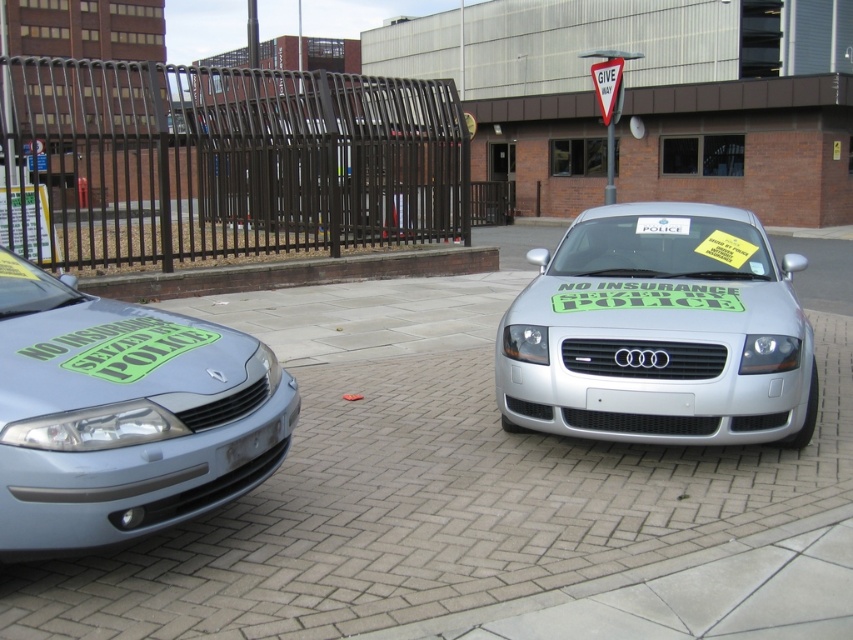
You are standing at the point marked by the coordinates point (659, 333). Looking around, you see a silver metallic car at center. Which direction should you face to see the silver metallic car at center?

You are already facing the silver metallic car at center because the point (659, 333) indicates the location of the silver metallic car at center.

You are a pedestrian standing at the edge of the paved area where the two cars are parked. You notice the green matte sticker at center and the brown concrete curb at center. Which object is closer to you, the pedestrian?

The brown concrete curb at center is closer to you because the green matte sticker at center is behind it.

You are a delivery driver who needs to park your van between the brown concrete curb at center and the green matte sticker at center. Can your van fit vertically between them?

The brown concrete curb at center is taller than the green matte sticker at center, so the vertical space between them is sufficient for the van to fit as long as the height of the van is less than the height of the curb.